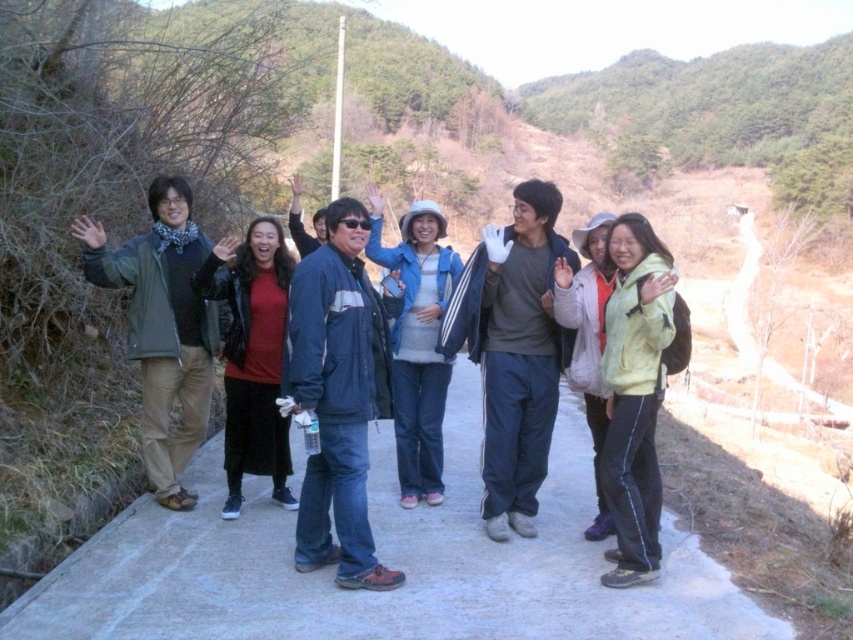
You are standing at the viewpoint of the image and want to hand a small gift to someone wearing the blue denim jacket at center. Considering the jacket is 13.39 feet away, can you reach them without moving closer?

The blue denim jacket at center is 13.39 feet away from the viewer, so you cannot reach them without moving closer as that distance is too far for a typical arm reach.